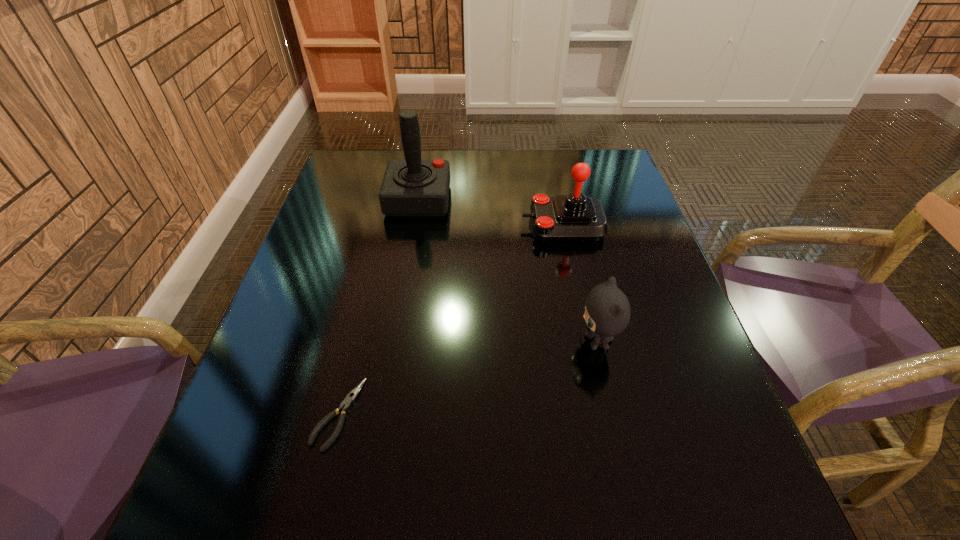
At what (x,y) coordinates should I click in order to perform the action: click on the tallest object. Please return your answer as a coordinate pair (x, y). The height and width of the screenshot is (540, 960). Looking at the image, I should click on (412, 187).

The width and height of the screenshot is (960, 540). Identify the location of the left joystick. (412, 187).

This screenshot has height=540, width=960. Find the location of `the right joystick`. the right joystick is located at coordinates (575, 217).

Find the location of `the third shortest object`. the third shortest object is located at coordinates (575, 217).

At what (x,y) coordinates should I click in order to perform the action: click on the second nearest object. Please return your answer as a coordinate pair (x, y). The width and height of the screenshot is (960, 540). Looking at the image, I should click on (607, 313).

You are a GUI agent. You are given a task and a screenshot of the screen. Output one action in this format:
    pyautogui.click(x=<x>, y=<y>)
    Task: Click on the second shortest object
    The width and height of the screenshot is (960, 540).
    Given the screenshot: What is the action you would take?
    pyautogui.click(x=607, y=313)

You are a GUI agent. You are given a task and a screenshot of the screen. Output one action in this format:
    pyautogui.click(x=<x>, y=<y>)
    Task: Click on the pliers
    
    Given the screenshot: What is the action you would take?
    pyautogui.click(x=345, y=405)

The image size is (960, 540). Find the location of `the shortest object`. the shortest object is located at coordinates (345, 405).

Where is `vacant space located 0.330m on the base of the tallest object`? vacant space located 0.330m on the base of the tallest object is located at coordinates (569, 200).

At what (x,y) coordinates should I click in order to perform the action: click on free space located 0.310m on the base of the third shortest object. Please return your answer as a coordinate pair (x, y). The width and height of the screenshot is (960, 540). Looking at the image, I should click on 401,225.